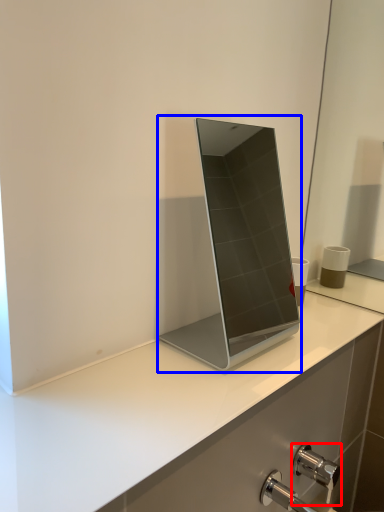
Question: Among these objects, which one is nearest to the camera, tap (highlighted by a red box) or laptop (highlighted by a blue box)?

Choices:
 (A) tap
 (B) laptop

Answer: (B)